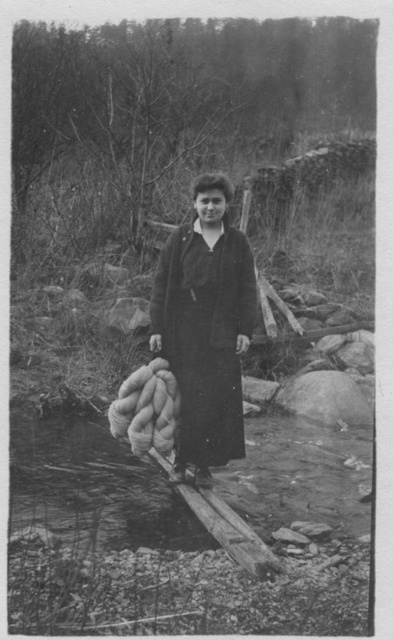
Who is more forward, (205, 540) or (192, 221)?

Point (205, 540) is in front.

Does smooth stone stream at center have a larger size compared to dark wool coat at center?

Correct, smooth stone stream at center is larger in size than dark wool coat at center.

Find the location of `smooth stone stream at center`. smooth stone stream at center is located at coordinates (93, 488).